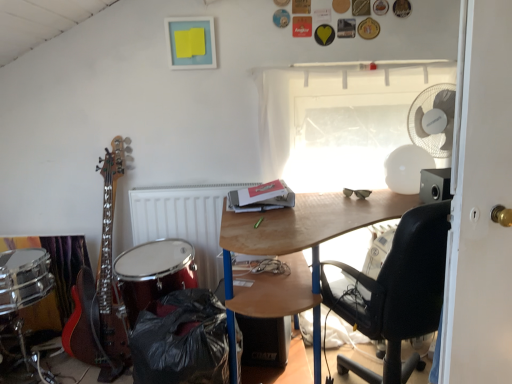
Question: From the image's perspective, is black plastic trash can at lower left on top of white plastic mechanical fan at upper right?

Choices:
 (A) no
 (B) yes

Answer: (A)

Question: Is black plastic trash can at lower left smaller than white plastic mechanical fan at upper right?

Choices:
 (A) no
 (B) yes

Answer: (A)

Question: Is black plastic trash can at lower left thinner than white plastic mechanical fan at upper right?

Choices:
 (A) yes
 (B) no

Answer: (B)

Question: Is black plastic trash can at lower left aimed at white plastic mechanical fan at upper right?

Choices:
 (A) yes
 (B) no

Answer: (B)

Question: Is white plastic mechanical fan at upper right inside black plastic trash can at lower left?

Choices:
 (A) yes
 (B) no

Answer: (B)

Question: From a real-world perspective, is black plastic trash can at lower left physically below white plastic mechanical fan at upper right?

Choices:
 (A) no
 (B) yes

Answer: (B)

Question: Is black matte speaker at lower center far from white matte radiator at center?

Choices:
 (A) yes
 (B) no

Answer: (B)

Question: Is black matte speaker at lower center surrounding white matte radiator at center?

Choices:
 (A) yes
 (B) no

Answer: (B)

Question: Does black matte speaker at lower center come behind white matte radiator at center?

Choices:
 (A) no
 (B) yes

Answer: (A)

Question: Considering the relative sizes of black matte speaker at lower center and white matte radiator at center in the image provided, is black matte speaker at lower center bigger than white matte radiator at center?

Choices:
 (A) yes
 (B) no

Answer: (B)

Question: Is black matte speaker at lower center shorter than white matte radiator at center?

Choices:
 (A) no
 (B) yes

Answer: (B)

Question: Is black matte speaker at lower center with white matte radiator at center?

Choices:
 (A) no
 (B) yes

Answer: (A)

Question: Are shiny red drum at lower left and transparent plastic window at upper center located far from each other?

Choices:
 (A) yes
 (B) no

Answer: (B)